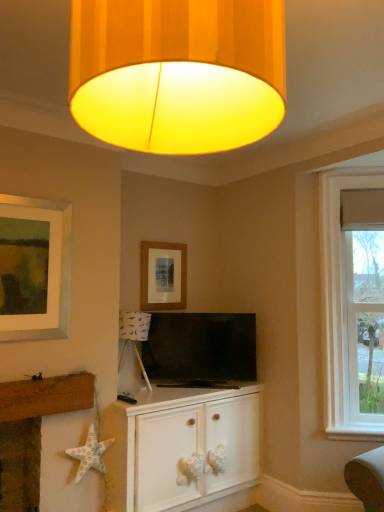
Question: Considering the relative positions of clear glass window at right and white wood cabinet at center in the image provided, is clear glass window at right behind white wood cabinet at center?

Choices:
 (A) yes
 (B) no

Answer: (A)

Question: Is clear glass window at right positioned beyond the bounds of white wood cabinet at center?

Choices:
 (A) yes
 (B) no

Answer: (A)

Question: Is the depth of clear glass window at right less than that of white wood cabinet at center?

Choices:
 (A) yes
 (B) no

Answer: (B)

Question: Can you confirm if clear glass window at right is taller than white wood cabinet at center?

Choices:
 (A) yes
 (B) no

Answer: (A)

Question: Can you confirm if clear glass window at right is positioned to the right of white wood cabinet at center?

Choices:
 (A) yes
 (B) no

Answer: (A)

Question: Is clear glass window at right shorter than white wood cabinet at center?

Choices:
 (A) yes
 (B) no

Answer: (B)

Question: Considering the relative sizes of white fabric starfish at lower left and white paper starfish at lower left in the image provided, is white fabric starfish at lower left taller than white paper starfish at lower left?

Choices:
 (A) yes
 (B) no

Answer: (A)

Question: From the image's perspective, is white fabric starfish at lower left located beneath white paper starfish at lower left?

Choices:
 (A) yes
 (B) no

Answer: (B)

Question: Is white fabric starfish at lower left placed right next to white paper starfish at lower left?

Choices:
 (A) yes
 (B) no

Answer: (B)

Question: From a real-world perspective, does white fabric starfish at lower left stand above white paper starfish at lower left?

Choices:
 (A) no
 (B) yes

Answer: (A)

Question: Is the depth of white fabric starfish at lower left less than that of white paper starfish at lower left?

Choices:
 (A) no
 (B) yes

Answer: (B)

Question: Is white paper starfish at lower left surrounded by white fabric starfish at lower left?

Choices:
 (A) yes
 (B) no

Answer: (B)

Question: Is clear glass window at right behind matte wooden picture frame at upper center?

Choices:
 (A) no
 (B) yes

Answer: (A)